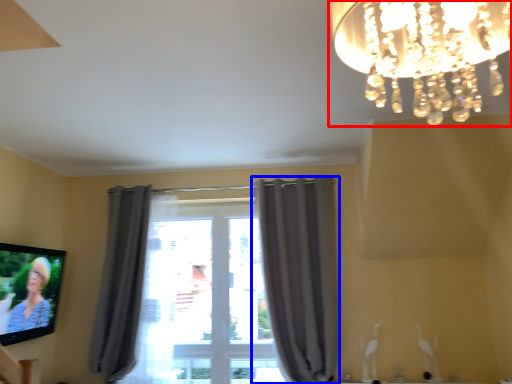
Question: Which object is closer to the camera taking this photo, lamp (highlighted by a red box) or curtain (highlighted by a blue box)?

Choices:
 (A) lamp
 (B) curtain

Answer: (A)